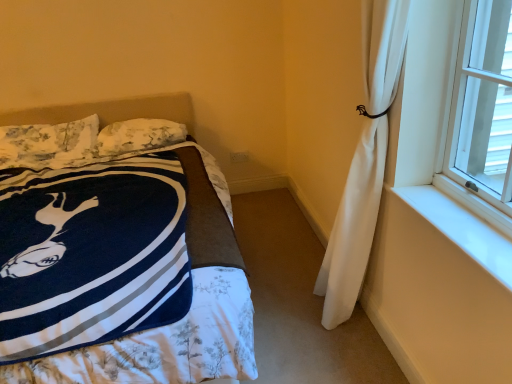
The width and height of the screenshot is (512, 384). Describe the element at coordinates (139, 136) in the screenshot. I see `fluffy white pillow at upper left, the 2th pillow in the left-to-right sequence` at that location.

Where is `floral fabric pillow at upper left, which is the second pillow from right to left`? This screenshot has height=384, width=512. floral fabric pillow at upper left, which is the second pillow from right to left is located at coordinates (48, 144).

Can you confirm if fluffy white pillow at upper left, the 2th pillow in the left-to-right sequence, is wider than navy blue fleece blanket at left?

No.

Is point (113, 138) positioned behind point (37, 108)?

That is False.

Is navy blue fleece blanket at left at the back of fluffy white pillow at upper left, the 2th pillow in the left-to-right sequence?

Yes, fluffy white pillow at upper left, the 2th pillow in the left-to-right sequence, is facing away from navy blue fleece blanket at left.

From the image's perspective, which pillow is the 1st one above the navy blue fleece blanket at left? Please provide its 2D coordinates.

[(48, 144)]

Considering their positions, is floral fabric pillow at upper left, arranged as the 1th pillow when viewed from the left, located in front of or behind navy blue fleece blanket at left?

floral fabric pillow at upper left, arranged as the 1th pillow when viewed from the left, is behind navy blue fleece blanket at left.

Is floral fabric pillow at upper left, which is the second pillow from right to left, bigger than navy blue fleece blanket at left?

Actually, floral fabric pillow at upper left, which is the second pillow from right to left, might be smaller than navy blue fleece blanket at left.

Is floral fabric pillow at upper left, which is the second pillow from right to left, wider or thinner than navy blue fleece blanket at left?

Clearly, floral fabric pillow at upper left, which is the second pillow from right to left, has less width compared to navy blue fleece blanket at left.

You are a GUI agent. You are given a task and a screenshot of the screen. Output one action in this format:
    pyautogui.click(x=<x>, y=<y>)
    Task: Click on the window sill in front of the fluffy white pillow at upper left, the 2th pillow in the left-to-right sequence
    The height and width of the screenshot is (384, 512).
    Given the screenshot: What is the action you would take?
    pyautogui.click(x=462, y=229)

Considering the relative positions of white smooth window sill at right and fluffy white pillow at upper left, the first pillow when ordered from right to left, in the image provided, is white smooth window sill at right to the right of fluffy white pillow at upper left, the first pillow when ordered from right to left, from the viewer's perspective?

Yes, white smooth window sill at right is to the right of fluffy white pillow at upper left, the first pillow when ordered from right to left.

Considering the relative sizes of white smooth window sill at right and fluffy white pillow at upper left, the 2th pillow in the left-to-right sequence, in the image provided, is white smooth window sill at right wider than fluffy white pillow at upper left, the 2th pillow in the left-to-right sequence,?

In fact, white smooth window sill at right might be narrower than fluffy white pillow at upper left, the 2th pillow in the left-to-right sequence.

Consider the image. Is white smooth window sill at right further to camera compared to fluffy white pillow at upper left, the 2th pillow in the left-to-right sequence?

No, it is in front of fluffy white pillow at upper left, the 2th pillow in the left-to-right sequence.

Is fluffy white pillow at upper left, the 2th pillow in the left-to-right sequence, in contact with floral fabric pillow at upper left, which is the second pillow from right to left?

No, fluffy white pillow at upper left, the 2th pillow in the left-to-right sequence, is not making contact with floral fabric pillow at upper left, which is the second pillow from right to left.

From a real-world perspective, is fluffy white pillow at upper left, the 2th pillow in the left-to-right sequence, located higher than floral fabric pillow at upper left, which is the second pillow from right to left?

No, from a real-world perspective, fluffy white pillow at upper left, the 2th pillow in the left-to-right sequence, is not above floral fabric pillow at upper left, which is the second pillow from right to left.

Do you think fluffy white pillow at upper left, the 2th pillow in the left-to-right sequence, is within floral fabric pillow at upper left, arranged as the 1th pillow when viewed from the left, or outside of it?

fluffy white pillow at upper left, the 2th pillow in the left-to-right sequence, cannot be found inside floral fabric pillow at upper left, arranged as the 1th pillow when viewed from the left.

Between white smooth window sill at right and navy blue fleece blanket at left, which one is positioned in front?

navy blue fleece blanket at left is closer to the camera.

Can we say white smooth window sill at right lies outside navy blue fleece blanket at left?

→ Absolutely, white smooth window sill at right is external to navy blue fleece blanket at left.

Does white smooth window sill at right turn towards navy blue fleece blanket at left?

Yes, white smooth window sill at right is aimed at navy blue fleece blanket at left.

Between point (177, 113) and point (143, 129), which one is positioned in front?

Point (143, 129)

Is navy blue fleece blanket at left taller than fluffy white pillow at upper left, the first pillow when ordered from right to left?

Yes.

Can you confirm if navy blue fleece blanket at left is thinner than fluffy white pillow at upper left, the first pillow when ordered from right to left?

No.

Is fluffy white pillow at upper left, the first pillow when ordered from right to left, aimed at white smooth window sill at right?

No, fluffy white pillow at upper left, the first pillow when ordered from right to left, is not aimed at white smooth window sill at right.

Does point (114, 131) come farther from viewer compared to point (426, 193)?

Yes, it is behind point (426, 193).

Measure the distance between fluffy white pillow at upper left, the 2th pillow in the left-to-right sequence, and white smooth window sill at right.

fluffy white pillow at upper left, the 2th pillow in the left-to-right sequence, and white smooth window sill at right are 1.82 meters apart from each other.

Where is `window sill below the fluffy white pillow at upper left, the 2th pillow in the left-to-right sequence (from the image's perspective)`? The width and height of the screenshot is (512, 384). window sill below the fluffy white pillow at upper left, the 2th pillow in the left-to-right sequence (from the image's perspective) is located at coordinates (462, 229).

The height and width of the screenshot is (384, 512). What are the coordinates of `bed in front of the fluffy white pillow at upper left, the first pillow when ordered from right to left` in the screenshot? It's located at (111, 111).

Where is `bed below the floral fabric pillow at upper left, arranged as the 1th pillow when viewed from the left (from the image's perspective)`? bed below the floral fabric pillow at upper left, arranged as the 1th pillow when viewed from the left (from the image's perspective) is located at coordinates (111, 111).

Which object lies further to the anchor point fluffy white pillow at upper left, the first pillow when ordered from right to left, white smooth window sill at right or floral fabric pillow at upper left, which is the second pillow from right to left?

white smooth window sill at right lies further to fluffy white pillow at upper left, the first pillow when ordered from right to left, than the other object.

Considering their positions, is navy blue fleece blanket at left positioned closer to floral fabric pillow at upper left, arranged as the 1th pillow when viewed from the left, than white smooth window sill at right?

navy blue fleece blanket at left lies closer to floral fabric pillow at upper left, arranged as the 1th pillow when viewed from the left, than the other object.

In the scene shown: Estimate the real-world distances between objects in this image. Which object is closer to navy blue fleece blanket at left, fluffy white pillow at upper left, the 2th pillow in the left-to-right sequence, or floral fabric pillow at upper left, which is the second pillow from right to left?

floral fabric pillow at upper left, which is the second pillow from right to left, is positioned closer to the anchor navy blue fleece blanket at left.

Which object lies nearer to the anchor point floral fabric pillow at upper left, arranged as the 1th pillow when viewed from the left, fluffy white pillow at upper left, the 2th pillow in the left-to-right sequence, or white smooth window sill at right?

fluffy white pillow at upper left, the 2th pillow in the left-to-right sequence, is closer to floral fabric pillow at upper left, arranged as the 1th pillow when viewed from the left.

Estimate the real-world distances between objects in this image. Which object is closer to fluffy white pillow at upper left, the first pillow when ordered from right to left, navy blue fleece blanket at left or white smooth window sill at right?

Based on the image, navy blue fleece blanket at left appears to be nearer to fluffy white pillow at upper left, the first pillow when ordered from right to left.

Based on their spatial positions, is fluffy white pillow at upper left, the 2th pillow in the left-to-right sequence, or navy blue fleece blanket at left closer to white smooth window sill at right?

fluffy white pillow at upper left, the 2th pillow in the left-to-right sequence, is closer to white smooth window sill at right.

Which object lies further to the anchor point navy blue fleece blanket at left, fluffy white pillow at upper left, the first pillow when ordered from right to left, or white smooth window sill at right?

Among the two, white smooth window sill at right is located further to navy blue fleece blanket at left.

Looking at the image, which one is located further to navy blue fleece blanket at left, white smooth window sill at right or floral fabric pillow at upper left, which is the second pillow from right to left?

white smooth window sill at right is positioned further to the anchor navy blue fleece blanket at left.

You are a GUI agent. You are given a task and a screenshot of the screen. Output one action in this format:
    pyautogui.click(x=<x>, y=<y>)
    Task: Click on the pillow positioned between navy blue fleece blanket at left and fluffy white pillow at upper left, the 2th pillow in the left-to-right sequence, from near to far
    This screenshot has width=512, height=384.
    Given the screenshot: What is the action you would take?
    pyautogui.click(x=48, y=144)

This screenshot has width=512, height=384. Find the location of `window sill positioned between navy blue fleece blanket at left and fluffy white pillow at upper left, the first pillow when ordered from right to left, from near to far`. window sill positioned between navy blue fleece blanket at left and fluffy white pillow at upper left, the first pillow when ordered from right to left, from near to far is located at coordinates 462,229.

At what (x,y) coordinates should I click in order to perform the action: click on pillow located between floral fabric pillow at upper left, arranged as the 1th pillow when viewed from the left, and white smooth window sill at right in the left-right direction. Please return your answer as a coordinate pair (x, y). Image resolution: width=512 pixels, height=384 pixels. Looking at the image, I should click on (x=139, y=136).

Image resolution: width=512 pixels, height=384 pixels. Identify the location of bed located between floral fabric pillow at upper left, arranged as the 1th pillow when viewed from the left, and white smooth window sill at right in the left-right direction. (111, 111).